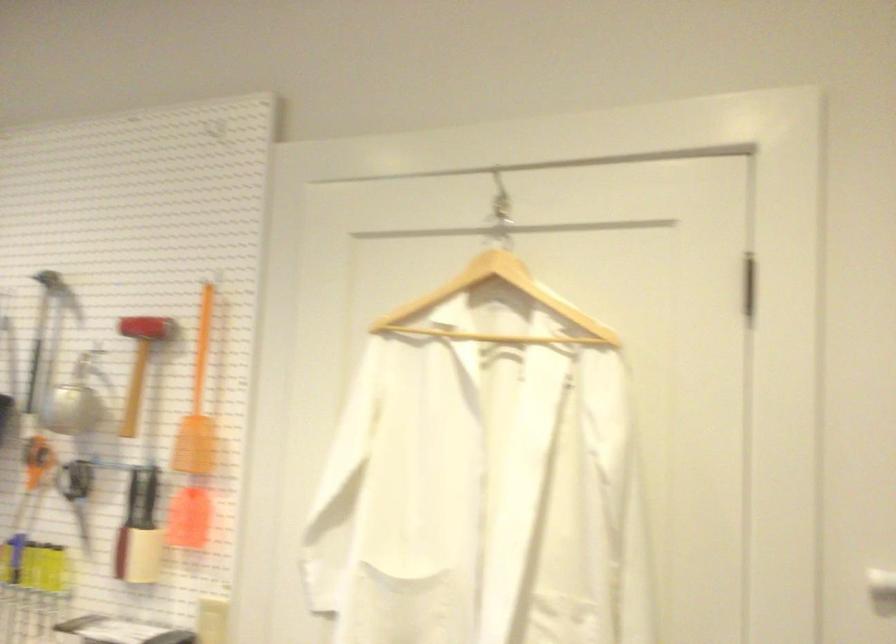
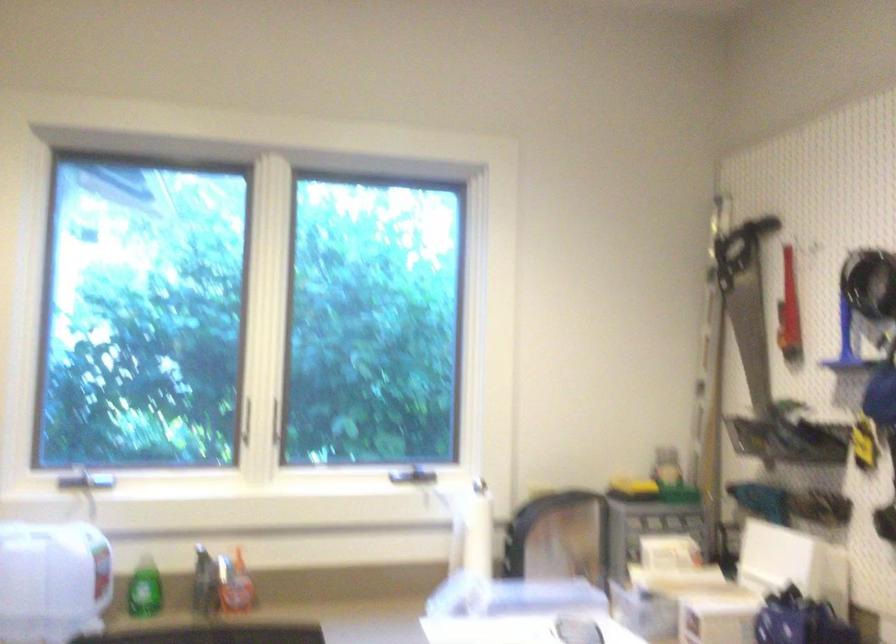
Question: The camera is either moving clockwise (left) or counter-clockwise (right) around the object. The first image is from the beginning of the video and the second image is from the end. Is the camera moving left or right when shooting the video?

Choices:
 (A) Left
 (B) Right

Answer: (B)